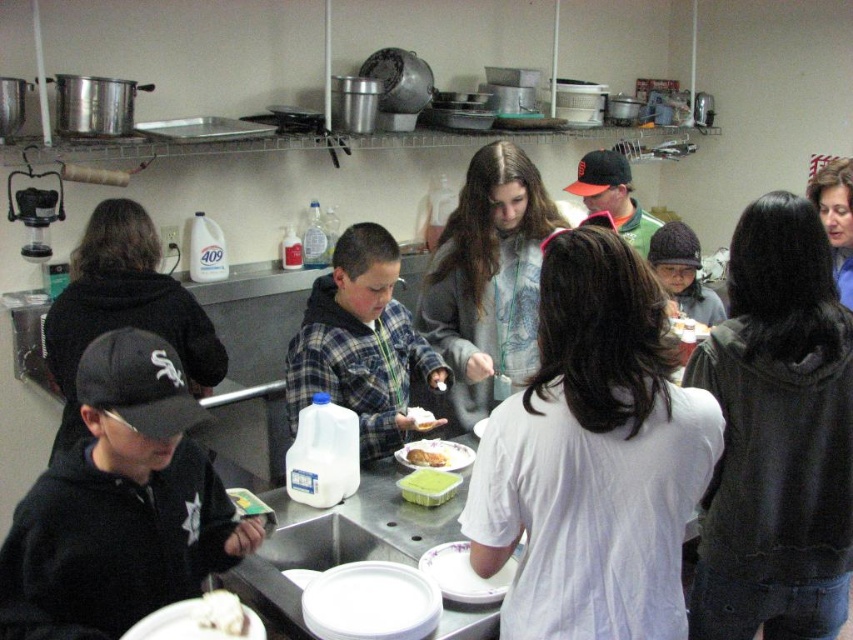
You are planning to serve a group of people in the communal kitchen. You have a white creamy cake at center and a green matte bread at center. Which item has a smaller width?

The white creamy cake at center has a smaller width than the green matte bread at center.

You are organizing a food distribution event and need to store the green matte bread at center. The green plastic container at center is available. Will the bread fit inside the container?

The green plastic container at center has a larger width than the green matte bread at center, so the bread should fit inside the container.

You are organizing a buffet table and need to arrange the white creamy cake at center and the green matte bread at center so that both are visible to guests. Since space is limited, which item should you place closer to the edge of the table to ensure both are accessible?

The green matte bread at center should be placed closer to the edge of the table because it is smaller in size than the white creamy cake at center, allowing both items to be visible and accessible within limited space.